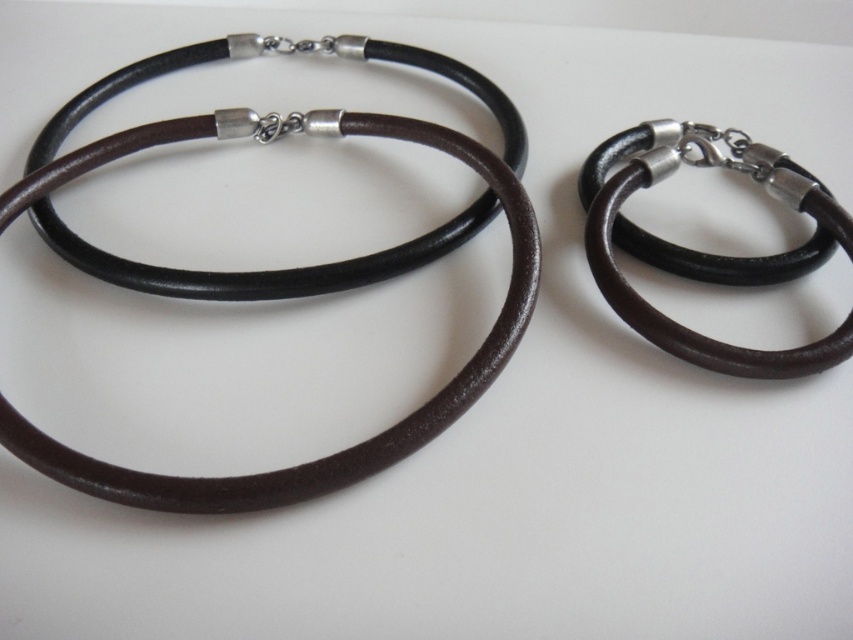
Question: Which point appears farthest from the camera in this image?

Choices:
 (A) tap(224, 488)
 (B) tap(753, 355)

Answer: (B)

Question: Which of the following is the closest to the observer?

Choices:
 (A) brown leather necklace at left
 (B) black leather bracelet at right

Answer: (A)

Question: Which point is closer to the camera taking this photo?

Choices:
 (A) (733, 154)
 (B) (383, 452)

Answer: (B)

Question: Is brown leather necklace at left below black leather bracelet at right?

Choices:
 (A) yes
 (B) no

Answer: (B)

Question: Is brown leather necklace at left bigger than black leather bracelet at right?

Choices:
 (A) yes
 (B) no

Answer: (A)

Question: In this image, where is brown leather necklace at left located relative to black leather bracelet at right?

Choices:
 (A) left
 (B) right

Answer: (A)